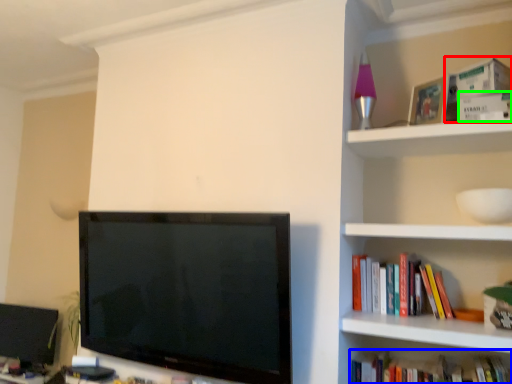
Question: Based on their relative distances, which object is nearer to paperback book (highlighted by a red box)? Choose from book (highlighted by a blue box) and paperback book (highlighted by a green box).

Choices:
 (A) book
 (B) paperback book

Answer: (B)